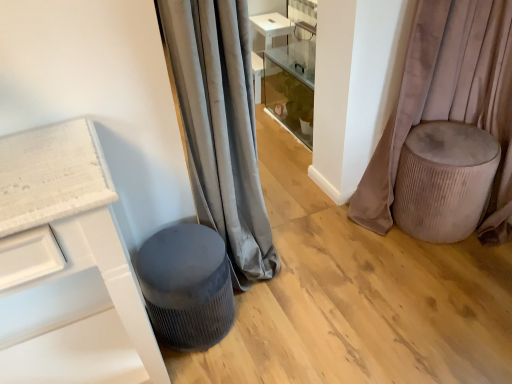
The image size is (512, 384). I want to click on empty space that is in between gray velvet curtain at center, the 2th curtain when ordered from right to left, and velvet grey stool at lower left, so click(268, 302).